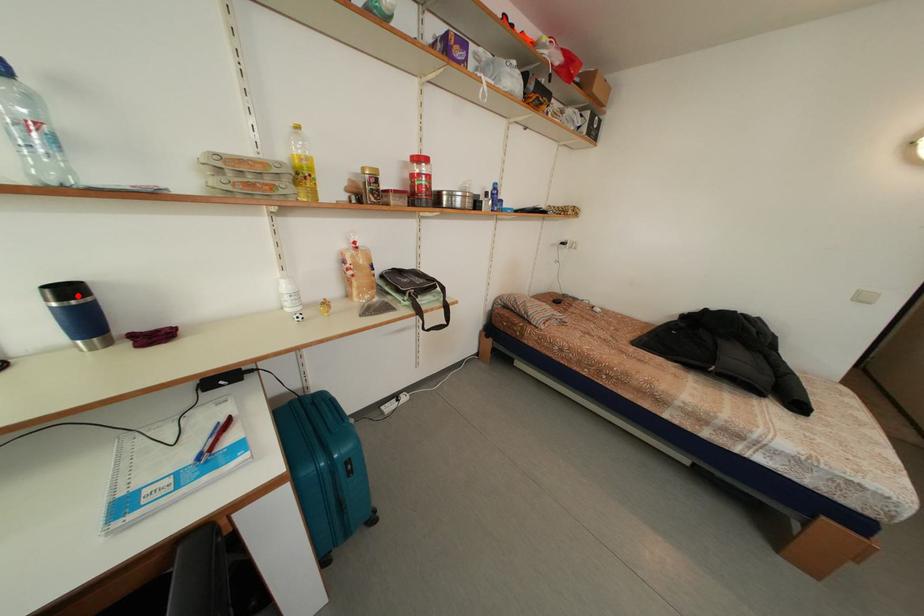
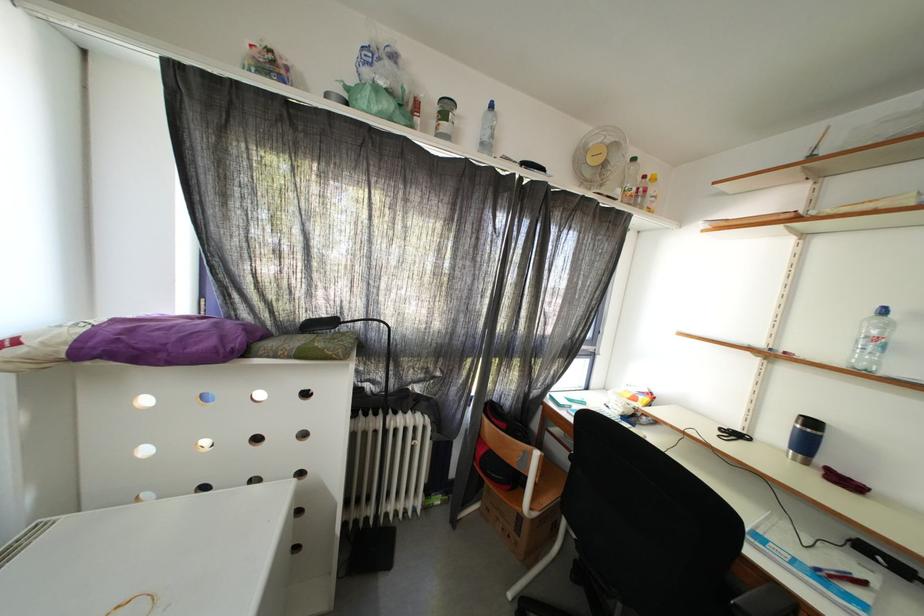
The point at the highlighted location is marked in the first image. Where is the corresponding point in the second image?

(820, 429)